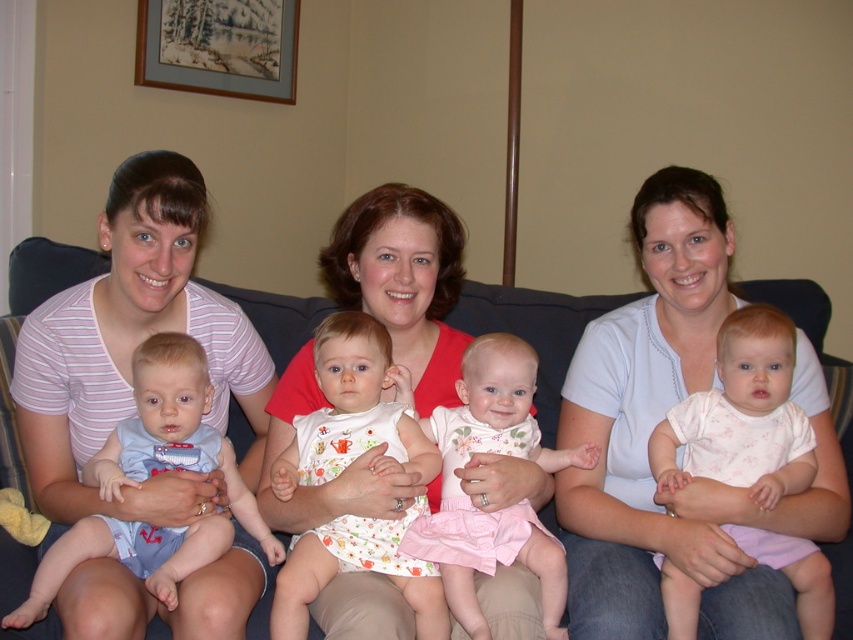
Which is more to the left, white floral onesie at center or wooden picture frame at upper center?

Result: From the viewer's perspective, wooden picture frame at upper center appears more on the left side.

In the scene shown: Between white floral onesie at center and wooden picture frame at upper center, which one is positioned higher?

Positioned higher is wooden picture frame at upper center.

Locate an element on the screen. white floral onesie at center is located at coordinates (741, 417).

Is floral cotton dress at center smaller than wooden picture frame at upper center?

Yes.

Locate an element on the screen. floral cotton dress at center is located at coordinates (498, 509).

In the scene shown: Is white floral onesie at center smaller than white cotton dress at center?

Yes, white floral onesie at center is smaller than white cotton dress at center.

Who is more distant from viewer, (802, 442) or (381, 339)?

The point (802, 442) is behind.

At what (x,y) coordinates should I click in order to perform the action: click on white floral onesie at center. Please return your answer as a coordinate pair (x, y). Looking at the image, I should click on click(741, 417).